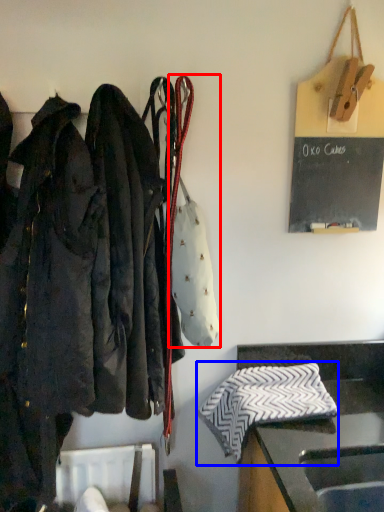
Question: Which object is closer to the camera taking this photo, handbag (highlighted by a red box) or cloth (highlighted by a blue box)?

Choices:
 (A) handbag
 (B) cloth

Answer: (A)